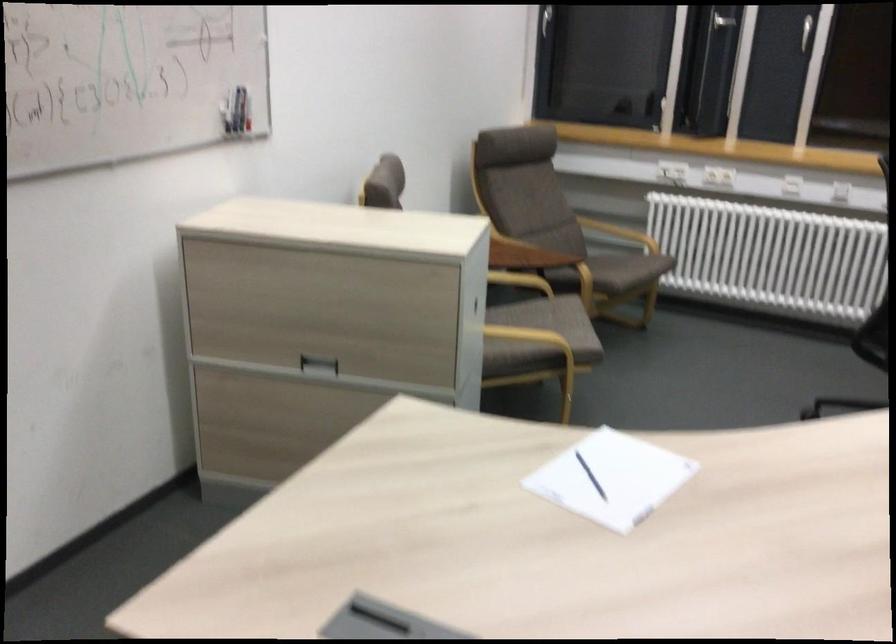
Where is `silver cabinet handle`? Image resolution: width=896 pixels, height=644 pixels. silver cabinet handle is located at coordinates (806, 32).